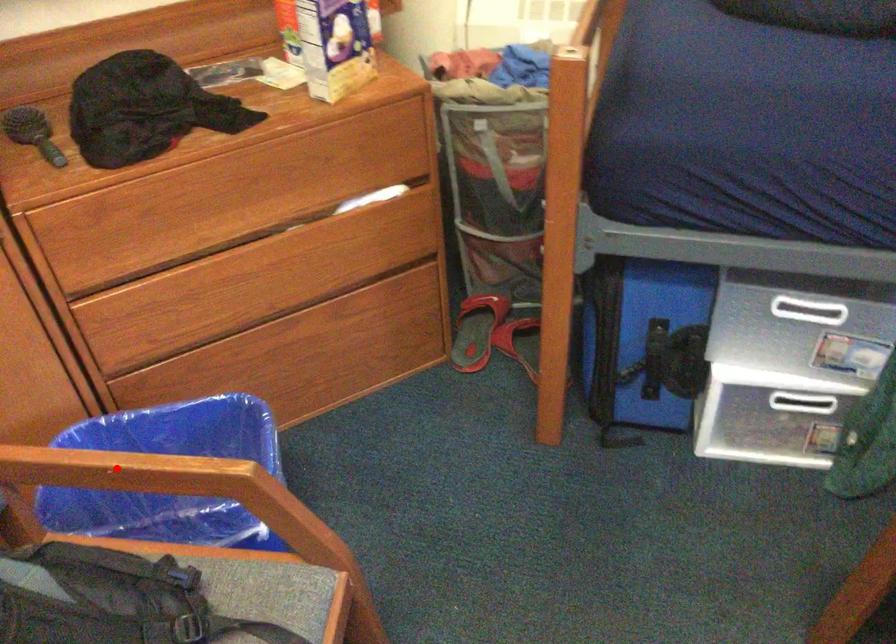
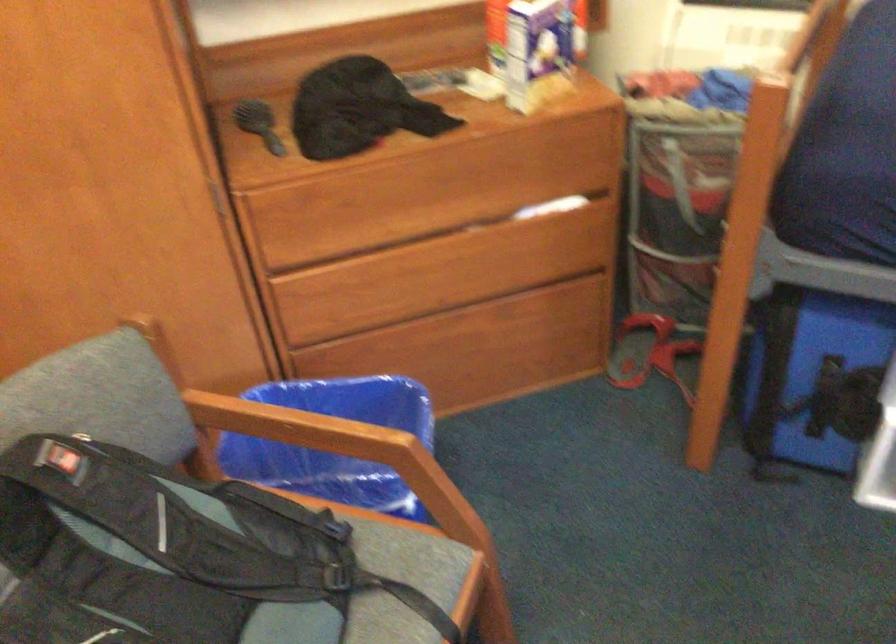
Question: I am providing you with two images of the same scene from different viewpoints. Image1 has a red point marked. In image2, the corresponding 3D location appears at what relative position? Reply with the corresponding letter.

Choices:
 (A) Closer
 (B) Farther

Answer: (B)